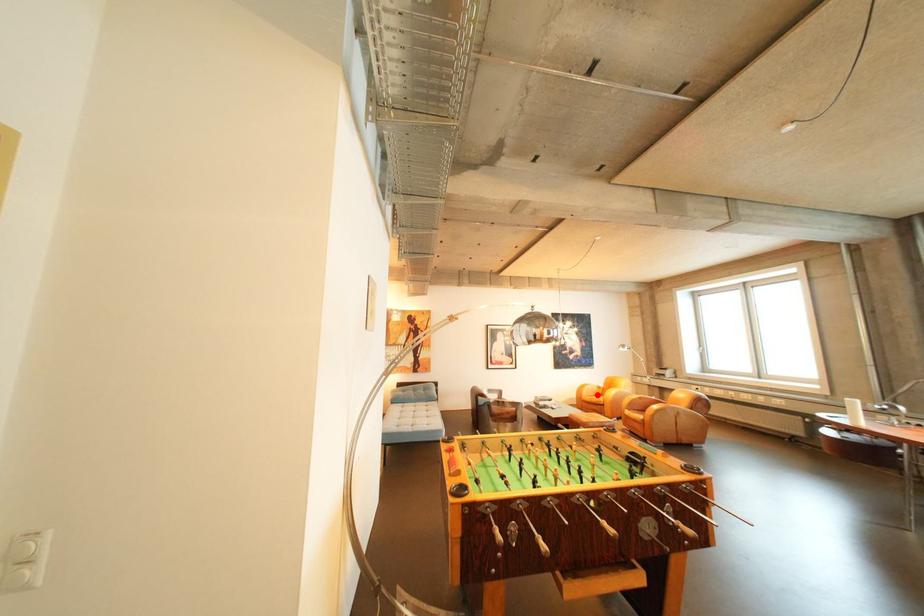
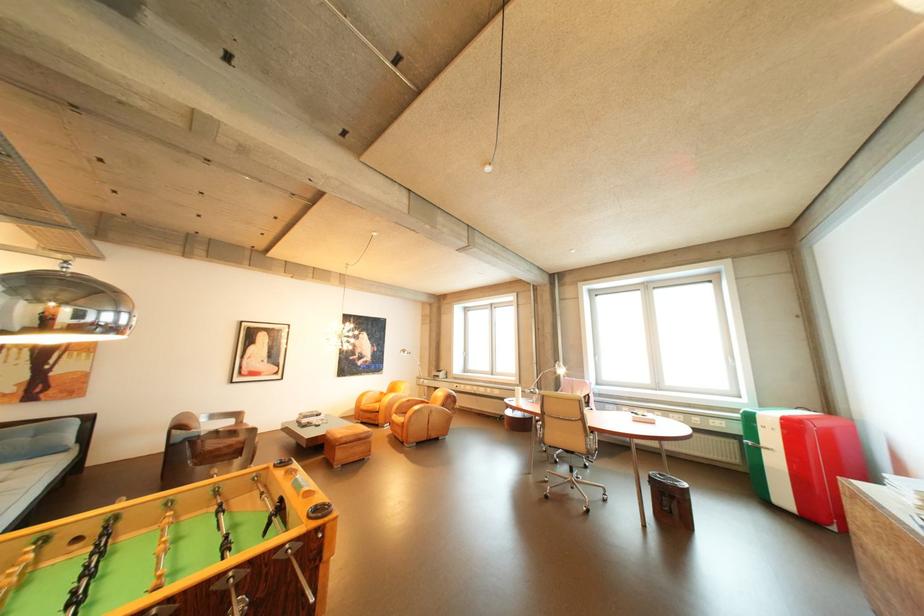
The point at the highlighted location is marked in the first image. Where is the corresponding point in the second image?

(377, 403)